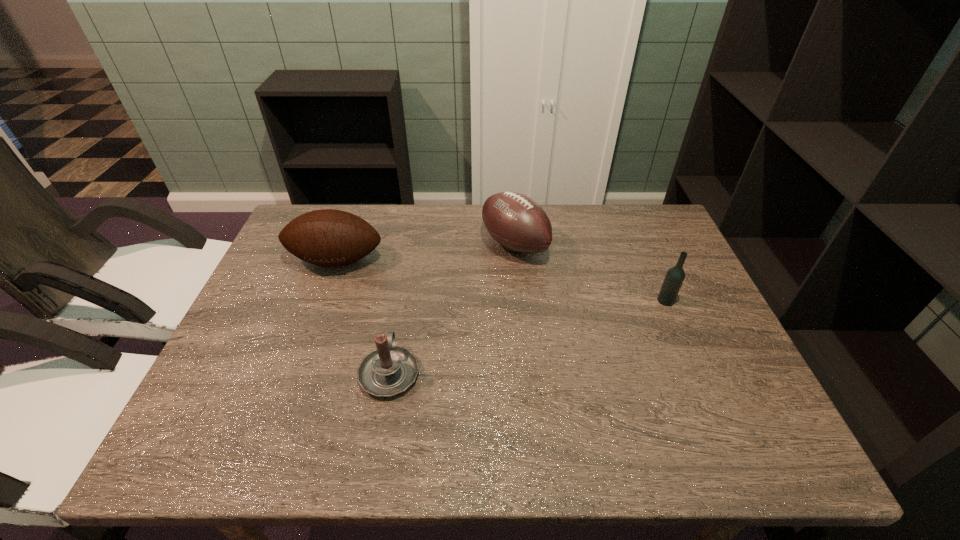
Identify the location of the second object from right to left. (514, 220).

This screenshot has width=960, height=540. I want to click on the left football, so click(327, 237).

The width and height of the screenshot is (960, 540). What are the coordinates of `the rightmost object` in the screenshot? It's located at (674, 278).

You are a GUI agent. You are given a task and a screenshot of the screen. Output one action in this format:
    pyautogui.click(x=<x>, y=<y>)
    Task: Click on the vodka
    This screenshot has height=540, width=960.
    Given the screenshot: What is the action you would take?
    pyautogui.click(x=674, y=278)

Image resolution: width=960 pixels, height=540 pixels. What are the coordinates of `the third object from right to left` in the screenshot? It's located at (389, 370).

Locate an element on the screen. candle is located at coordinates (389, 370).

Image resolution: width=960 pixels, height=540 pixels. What are the coordinates of `blank area located on the left of the second object from right to left` in the screenshot? It's located at (432, 245).

What are the coordinates of `vacant space located on the laces of the left football` in the screenshot? It's located at (282, 410).

Where is `vacant space located on the left of the third farthest object`? vacant space located on the left of the third farthest object is located at coordinates (631, 301).

This screenshot has width=960, height=540. Identify the location of vacant space located on the side of the second object from left to right with the handle loop. (411, 255).